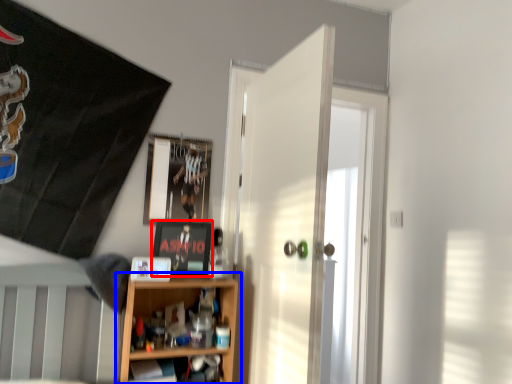
Question: Which of the following is the closest to the observer, picture frame (highlighted by a red box) or shelf (highlighted by a blue box)?

Choices:
 (A) picture frame
 (B) shelf

Answer: (B)